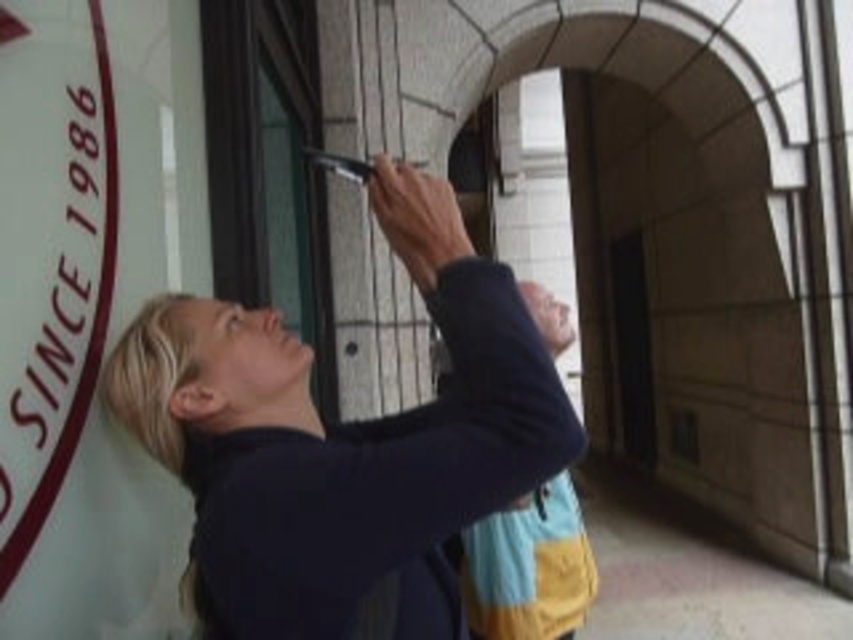
You are a technician trying to locate a matte black phone at upper center in the scene. The coordinates provided are point (x=343, y=442). Can you confirm if this point is to the right or left of the person?

The matte black phone at upper center is located at point (x=343, y=442). Since the person is on the left side of the image, the coordinates indicate the phone is to the right of the person.

You are a delivery person who needs to hang a new package label on the wall. The label requires 15 cm of space. You see the matte black phone at upper center and the white matte sign at upper left. Can you determine if there is enough space between them to place the label?

The matte black phone at upper center might be wider than the white matte sign at upper left, so the space between them may not be sufficient for the 15 cm label. Check the exact dimensions before placing it.